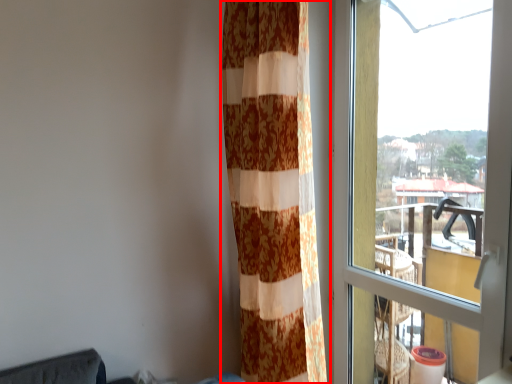
Question: In this image, where is curtain (annotated by the red box) located relative to window?

Choices:
 (A) left
 (B) right

Answer: (A)